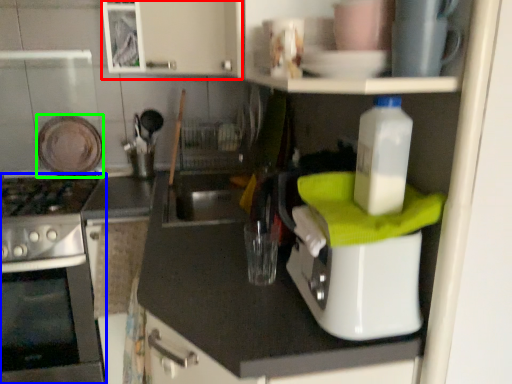
Question: Considering the real-world distances, which object is farthest from cabinetry (highlighted by a red box)? home appliance (highlighted by a blue box) or appliance (highlighted by a green box)?

Choices:
 (A) home appliance
 (B) appliance

Answer: (A)